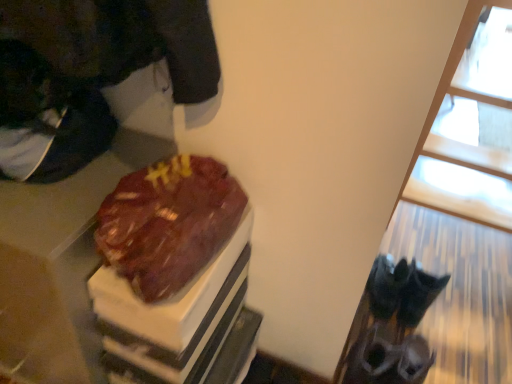
Question: Should I look upward or downward to see shiny chocolate cake at center?

Choices:
 (A) down
 (B) up

Answer: (A)

Question: Can you confirm if shiny chocolate cake at center is wider than transparent glass window at upper right?

Choices:
 (A) yes
 (B) no

Answer: (B)

Question: Does shiny chocolate cake at center appear on the right side of transparent glass window at upper right?

Choices:
 (A) yes
 (B) no

Answer: (B)

Question: Considering the relative sizes of shiny chocolate cake at center and transparent glass window at upper right in the image provided, is shiny chocolate cake at center smaller than transparent glass window at upper right?

Choices:
 (A) yes
 (B) no

Answer: (A)

Question: From a real-world perspective, is shiny chocolate cake at center located higher than transparent glass window at upper right?

Choices:
 (A) no
 (B) yes

Answer: (B)

Question: Can you confirm if shiny chocolate cake at center is shorter than transparent glass window at upper right?

Choices:
 (A) no
 (B) yes

Answer: (B)

Question: Is the surface of shiny chocolate cake at center in direct contact with transparent glass window at upper right?

Choices:
 (A) yes
 (B) no

Answer: (B)

Question: Is shiny chocolate cake at center at the back of transparent glass window at upper right?

Choices:
 (A) no
 (B) yes

Answer: (A)

Question: Is transparent glass window at upper right smaller than shiny chocolate cake at center?

Choices:
 (A) no
 (B) yes

Answer: (A)

Question: From the image's perspective, is transparent glass window at upper right under shiny chocolate cake at center?

Choices:
 (A) yes
 (B) no

Answer: (B)

Question: Does transparent glass window at upper right appear on the left side of shiny chocolate cake at center?

Choices:
 (A) no
 (B) yes

Answer: (A)

Question: Does transparent glass window at upper right have a lesser height compared to shiny chocolate cake at center?

Choices:
 (A) yes
 (B) no

Answer: (B)

Question: Could you tell me if transparent glass window at upper right is facing shiny chocolate cake at center?

Choices:
 (A) no
 (B) yes

Answer: (A)

Question: In terms of size, does transparent glass window at upper right appear bigger or smaller than shiny chocolate cake at center?

Choices:
 (A) small
 (B) big

Answer: (B)